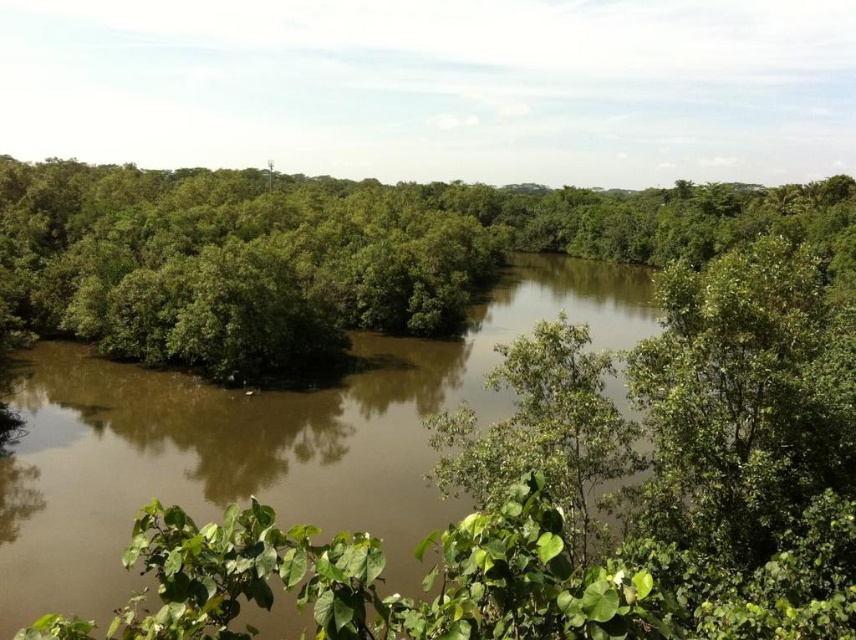
Where is `green leafy trees at center`? green leafy trees at center is located at coordinates coord(349,243).

At what (x,y) coordinates should I click in order to perform the action: click on green leafy trees at center. Please return your answer as a coordinate pair (x, y). This screenshot has width=856, height=640. Looking at the image, I should click on (349, 243).